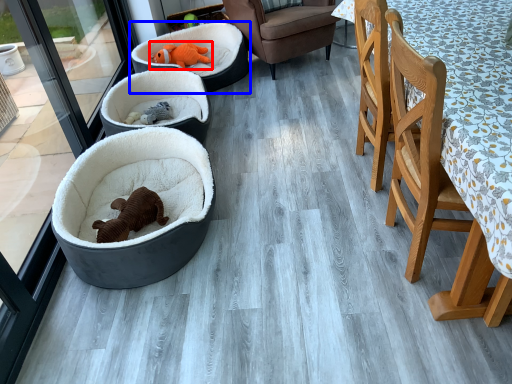
Question: Which object is closer to the camera taking this photo, animal (highlighted by a red box) or dog bed (highlighted by a blue box)?

Choices:
 (A) animal
 (B) dog bed

Answer: (B)